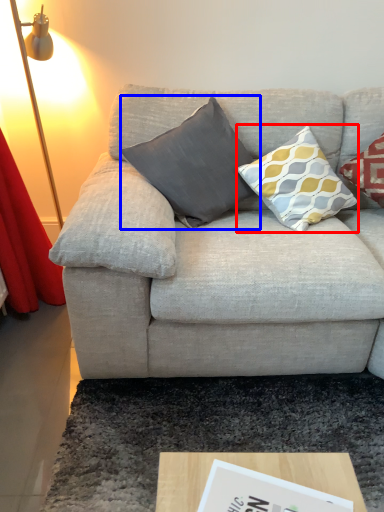
Question: Which of the following is the farthest to the observer, pillow (highlighted by a red box) or pillow (highlighted by a blue box)?

Choices:
 (A) pillow
 (B) pillow

Answer: (B)